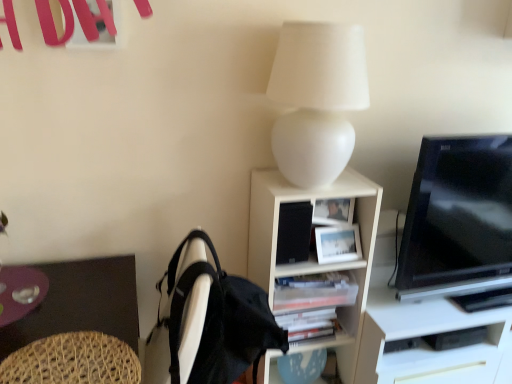
You are a GUI agent. You are given a task and a screenshot of the screen. Output one action in this format:
    pyautogui.click(x=<x>, y=<y>)
    Task: Click on the empty space that is ontop of brown woven desk at lower left (from a real-world perspective)
    The width and height of the screenshot is (512, 384).
    Given the screenshot: What is the action you would take?
    pyautogui.click(x=53, y=305)